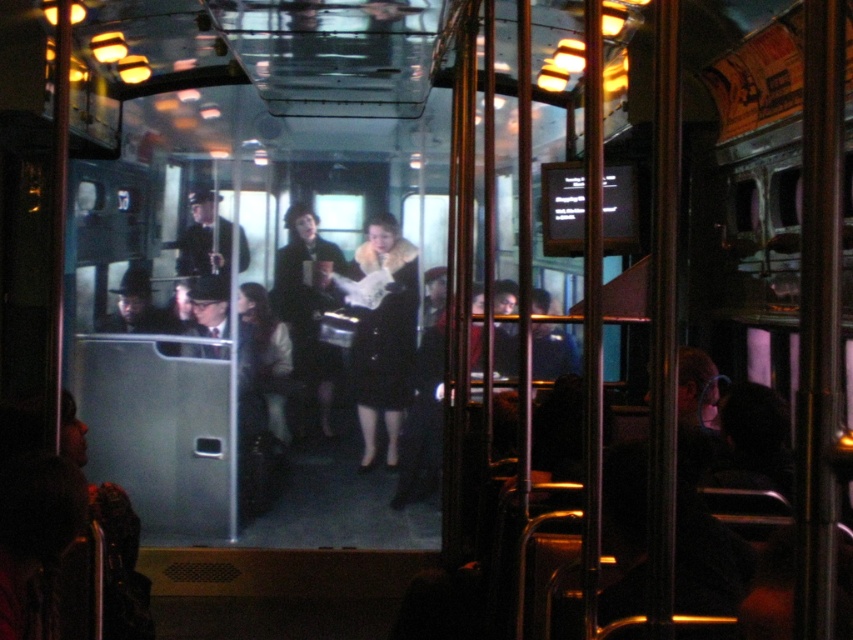
Question: Is matte black coat at center further to camera compared to uniformed dark coat at center?

Choices:
 (A) no
 (B) yes

Answer: (B)

Question: Does black velvet coat at center appear over matte black coat at center?

Choices:
 (A) yes
 (B) no

Answer: (A)

Question: Which point is closer to the camera?

Choices:
 (A) (351, 365)
 (B) (200, 272)

Answer: (B)

Question: Which object is positioned closest to the black velvet coat at center?

Choices:
 (A) matte black coat at center
 (B) uniformed dark coat at center

Answer: (A)

Question: Is matte black coat at center below uniformed dark coat at center?

Choices:
 (A) no
 (B) yes

Answer: (B)

Question: Which is farther from the black velvet coat at center?

Choices:
 (A) uniformed dark coat at center
 (B) matte black coat at center

Answer: (A)